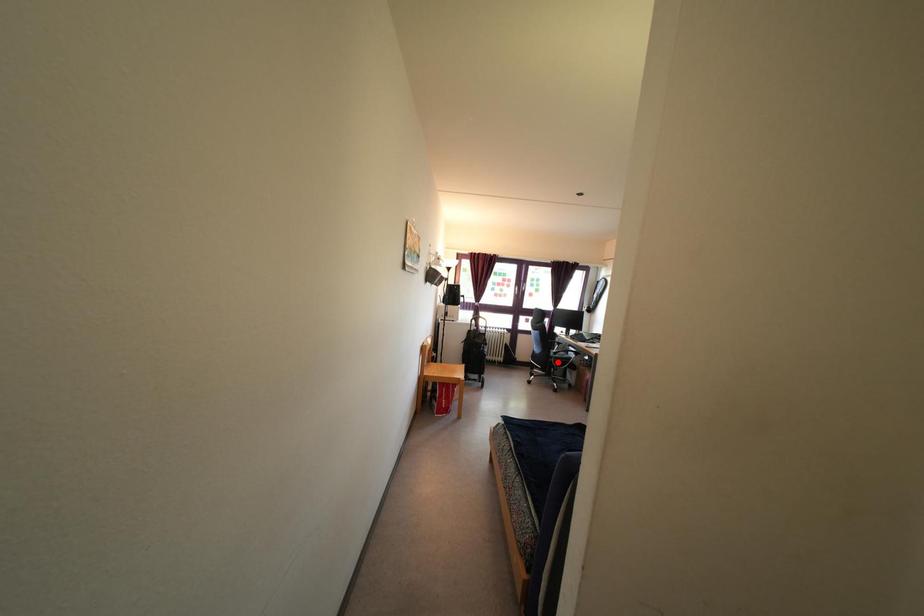
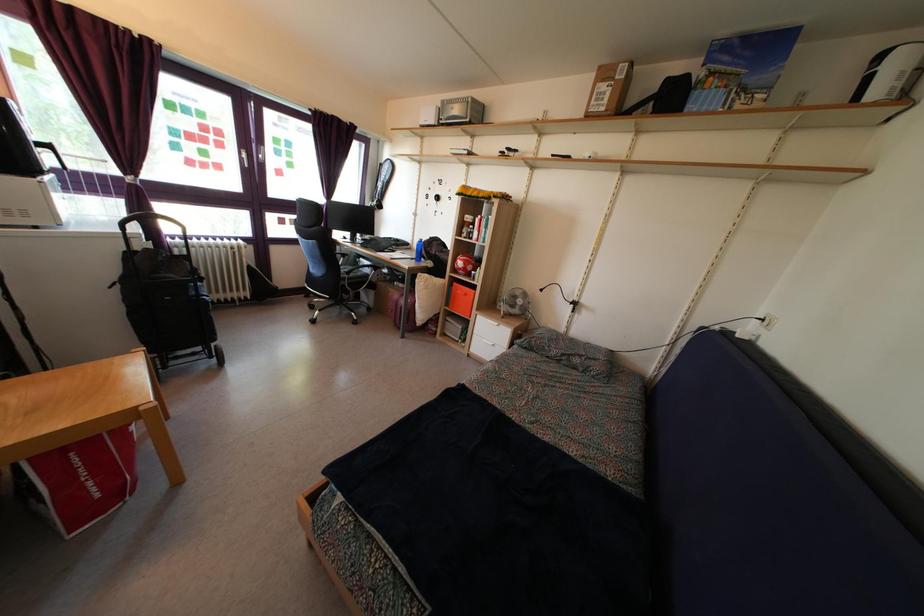
Question: A red point is marked in image1. In image2, is the corresponding 3D point closer to the camera or farther? Reply with the corresponding letter.

Choices:
 (A) The corresponding 3D point is closer.
 (B) The corresponding 3D point is farther.

Answer: (A)